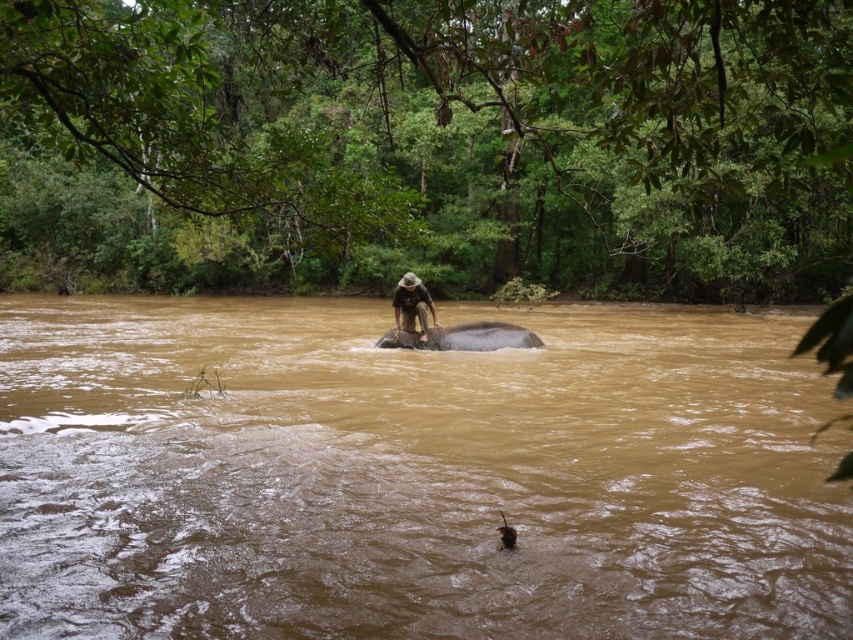
You are a wildlife photographer planning to take a photo of the brown muddy water at center and the brown textured baby elephant at lower center. You want to ensure both subjects are in focus simultaneously. Given that your camera has a depth of field that can cover 6 meters, will you be able to achieve this?

The distance between the brown muddy water at center and the brown textured baby elephant at lower center is 6.77 meters. Since the camera can only cover 6 meters, you will not be able to have both subjects in focus simultaneously.

You are a hiker who needs to cross the river. You see the brown muddy water at center and the gray matte elephant at center. Which object is closer to your left side when facing the river?

The brown muddy water at center is to the left of the gray matte elephant at center, so when facing the river, the brown muddy water at center would be closer to your left side.

You are standing at the camera position observing the forest river scene. There is a point of interest at point (103, 584). You want to throw a small stone to hit that point. Considering the elephant and the person on its back, which object is closer to the point so you can aim accordingly?

The distance of point (103, 584) from camera is 16.51 feet. Since the elephant and the person on its back are in the middle of the river, their distance from the camera would be more than 16.51 feet. Therefore, the point (103, 584) is closer to the camera than the elephant and the person on its back.